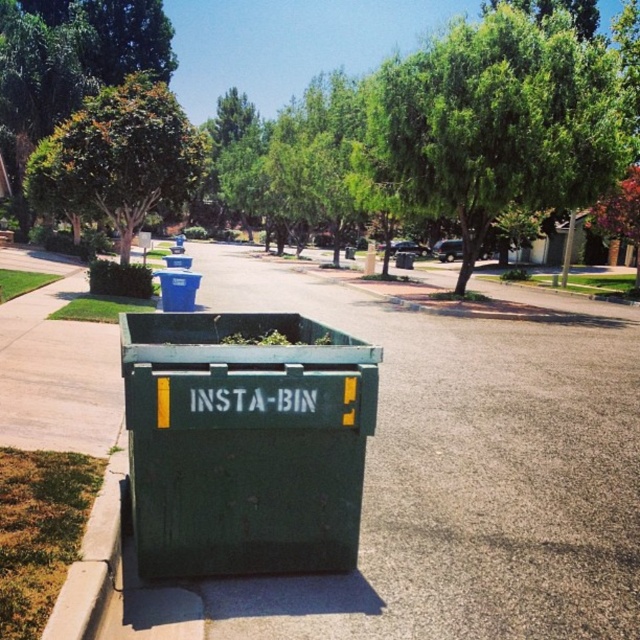
Who is taller, green grass at lower left or blue plastic recycling bin at upper left?

Standing taller between the two is blue plastic recycling bin at upper left.

Between green grass at lower left and blue plastic recycling bin at upper left, which one has less height?

green grass at lower left is shorter.

Identify the location of green grass at lower left. This screenshot has width=640, height=640. (38, 531).

Who is positioned more to the left, green asphalt pavement at center or green grass at lower left?

green grass at lower left is more to the left.

Is green asphalt pavement at center bigger than green grass at lower left?

Yes, green asphalt pavement at center is bigger than green grass at lower left.

Identify the location of green asphalt pavement at center. The height and width of the screenshot is (640, 640). (464, 474).

The image size is (640, 640). In order to click on green asphalt pavement at center in this screenshot , I will do `click(464, 474)`.

Does green leafy tree at upper center appear over blue plastic bin at center?

Indeed, green leafy tree at upper center is positioned over blue plastic bin at center.

How distant is green leafy tree at upper center from blue plastic bin at center?

They are 10.89 meters apart.

This screenshot has height=640, width=640. What do you see at coordinates (497, 122) in the screenshot? I see `green leafy tree at upper center` at bounding box center [497, 122].

Identify the location of green leafy tree at upper center. The width and height of the screenshot is (640, 640). (497, 122).